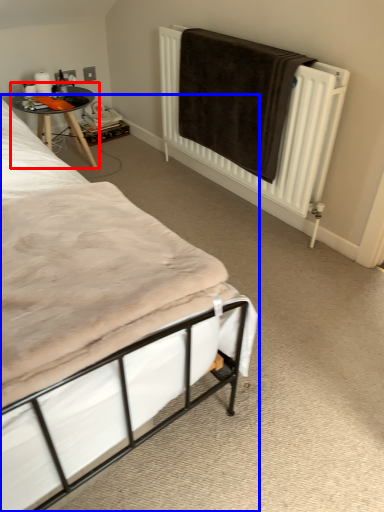
Question: Which object is closer to the camera taking this photo, table (highlighted by a red box) or bed (highlighted by a blue box)?

Choices:
 (A) table
 (B) bed

Answer: (B)